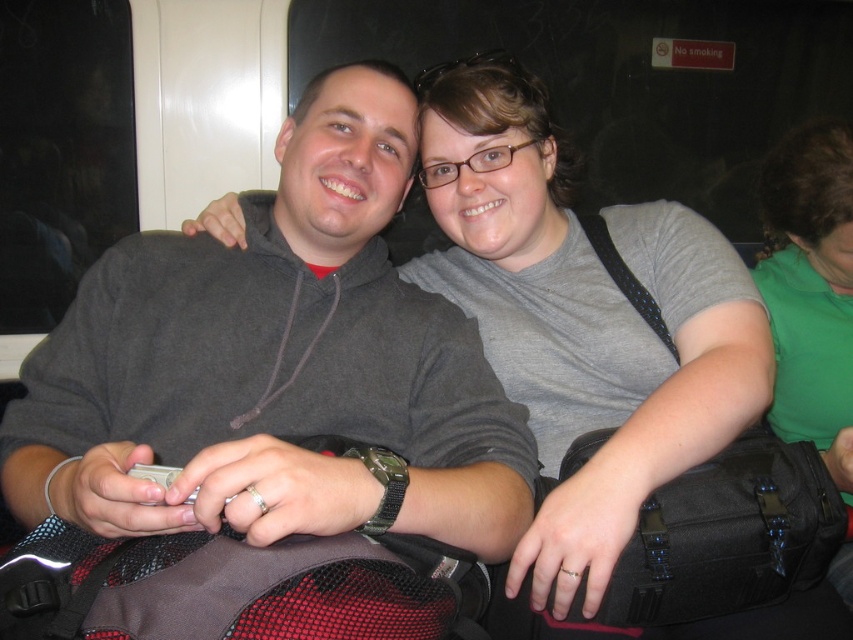
Based on the scene described, which object is shorter in height between the dark gray hoodie at center and the green fabric shirt at upper right?

The dark gray hoodie at center is shorter in height compared to the green fabric shirt at upper right.

You are designing a new seating arrangement for a train carriage. You need to ensure that passengers wearing a dark gray hoodie at center and a green fabric shirt at upper right can sit comfortably. Given their clothing sizes, which clothing item requires more horizontal space?

The dark gray hoodie at center requires more horizontal space because its width is larger than the green fabric shirt at upper right.